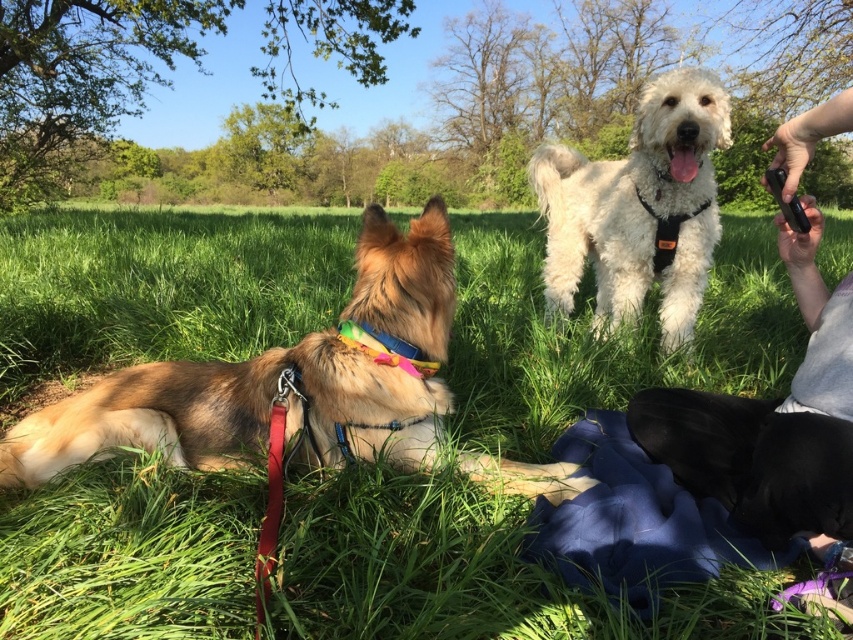
Is point (82, 305) in front of point (709, 176)?

No, (82, 305) is further to viewer.

Does green grass at center appear over white fluffy dog at upper center?

Correct, green grass at center is located above white fluffy dog at upper center.

What do you see at coordinates (158, 289) in the screenshot? The image size is (853, 640). I see `green grass at center` at bounding box center [158, 289].

This screenshot has height=640, width=853. I want to click on green grass at center, so click(x=158, y=289).

Does point (28, 458) come farther from viewer compared to point (654, 99)?

No, it is not.

Who is more distant from viewer, (122, 369) or (654, 221)?

The point (654, 221) is behind.

Is point (221, 401) closer to camera compared to point (654, 152)?

Yes, point (221, 401) is closer to viewer.

Image resolution: width=853 pixels, height=640 pixels. What are the coordinates of `golden fur dog at left` in the screenshot? It's located at (282, 380).

Is green grass at center positioned behind golden fur dog at left?

That is False.

Who is higher up, green grass at center or golden fur dog at left?

green grass at center is above.

Does point (305, 273) lie in front of point (236, 394)?

No.

At what (x,y) coordinates should I click in order to perform the action: click on green grass at center. Please return your answer as a coordinate pair (x, y). Looking at the image, I should click on (158, 289).